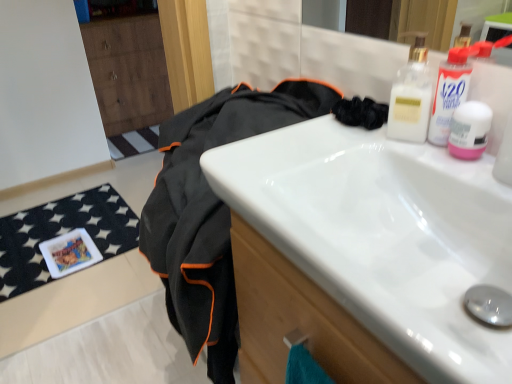
Question: Is the surface of white glossy sink at center in direct contact with black fabric at center?

Choices:
 (A) no
 (B) yes

Answer: (A)

Question: Considering the relative sizes of white glossy sink at center and black fabric at center in the image provided, is white glossy sink at center thinner than black fabric at center?

Choices:
 (A) no
 (B) yes

Answer: (B)

Question: Can you confirm if white glossy sink at center is smaller than black fabric at center?

Choices:
 (A) no
 (B) yes

Answer: (B)

Question: Is white glossy sink at center facing away from black fabric at center?

Choices:
 (A) yes
 (B) no

Answer: (B)

Question: From a real-world perspective, is white glossy sink at center located beneath black fabric at center?

Choices:
 (A) yes
 (B) no

Answer: (B)

Question: From the image's perspective, would you say white glossy sink at center is positioned over black fabric at center?

Choices:
 (A) no
 (B) yes

Answer: (B)

Question: Is black fabric at center positioned in front of white glossy sink at center?

Choices:
 (A) no
 (B) yes

Answer: (A)

Question: Considering the relative sizes of black fabric at center and white glossy sink at center in the image provided, is black fabric at center smaller than white glossy sink at center?

Choices:
 (A) no
 (B) yes

Answer: (A)

Question: Is black fabric at center beside white glossy sink at center?

Choices:
 (A) yes
 (B) no

Answer: (B)

Question: Can you confirm if black fabric at center is positioned to the left of white glossy sink at center?

Choices:
 (A) no
 (B) yes

Answer: (B)

Question: Considering the relative sizes of black fabric at center and white glossy sink at center in the image provided, is black fabric at center wider than white glossy sink at center?

Choices:
 (A) no
 (B) yes

Answer: (B)

Question: Is black fabric at center facing towards white glossy sink at center?

Choices:
 (A) yes
 (B) no

Answer: (B)

Question: Is white glossy sink at center to the left or to the right of black fabric at center in the image?

Choices:
 (A) right
 (B) left

Answer: (A)